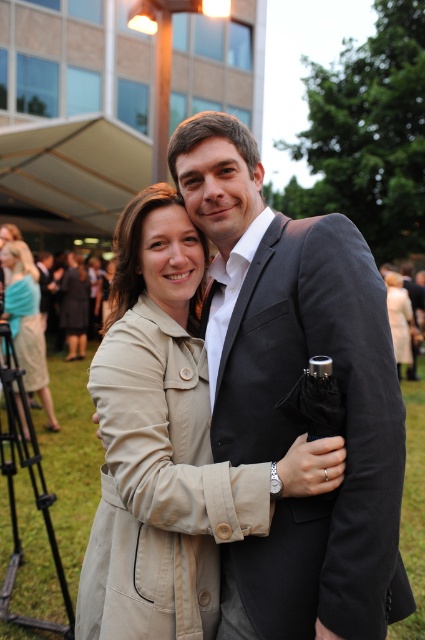
You are standing at the point with coordinates point (42, 332) and want to move towards the point with coordinates point (283, 637). Which direction should you move to reach your destination?

To move from point (42, 332) to point (283, 637), you should move forward since point (283, 637) is in front of point (42, 332).

You are a photographer at this event and need to adjust the camera focus. The minimum focus distance of your camera is 6 inches. Can you focus on both the matte black suit at center and the beige fabric coat at center without moving the camera?

The distance between the matte black suit at center and the beige fabric coat at center is 7.07 inches. Since the minimum focus distance is 6 inches, the camera can focus on both as the separation is within the required range.

You are at an outdoor event and notice two beige coats. The beige trench coat at lower left and the beige fabric coat at lower right. Which coat is closer to the ground?

The beige trench coat at lower left is positioned under the beige fabric coat at lower right, so it is closer to the ground.